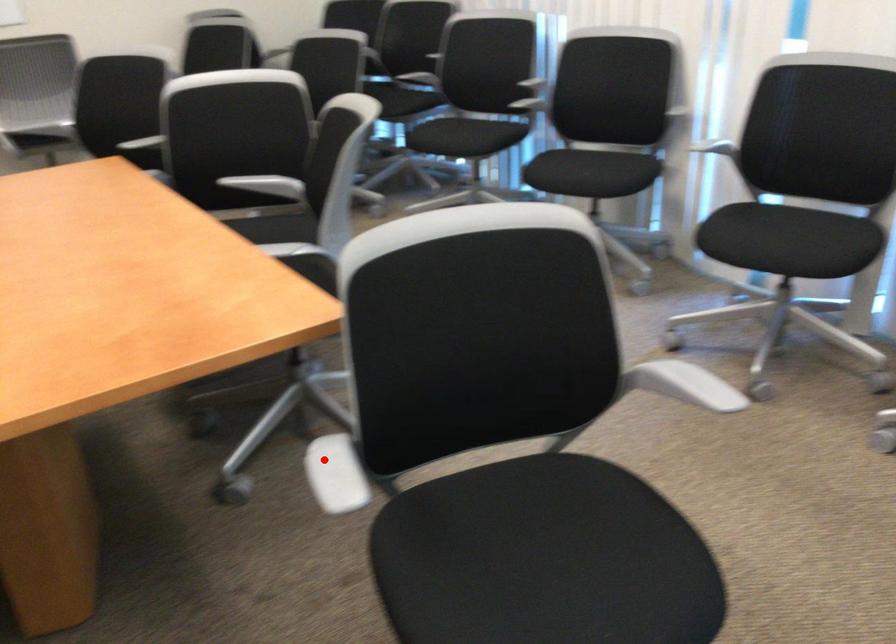
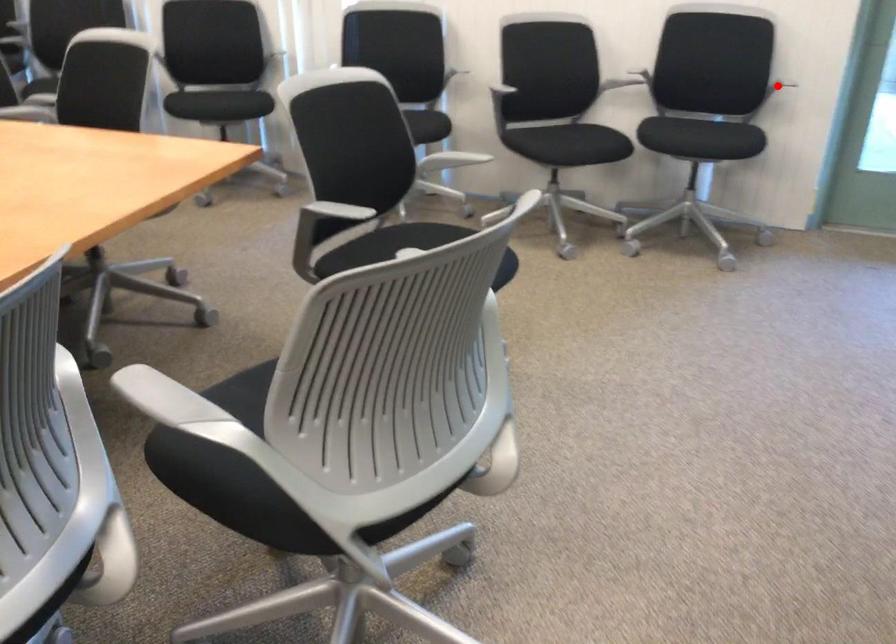
I am providing you with two images of the same scene from different viewpoints. A red point is marked on the first image and another point is marked on the second image. Do the highlighted points in image1 and image2 indicate the same real-world spot?

No